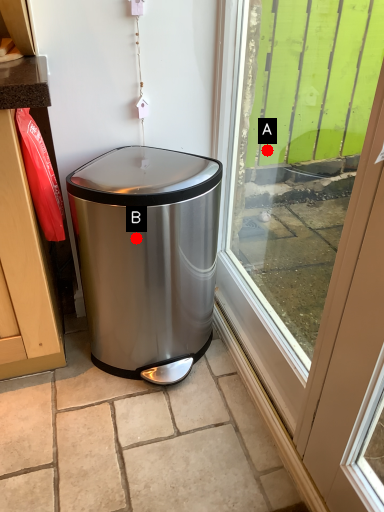
Question: Two points are circled on the image, labeled by A and B beside each circle. Which point appears closest to the camera in this image?

Choices:
 (A) A is closer
 (B) B is closer

Answer: (B)